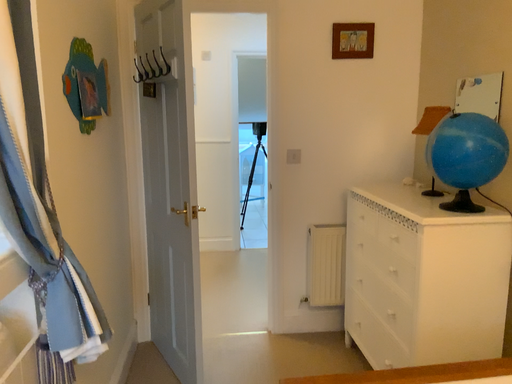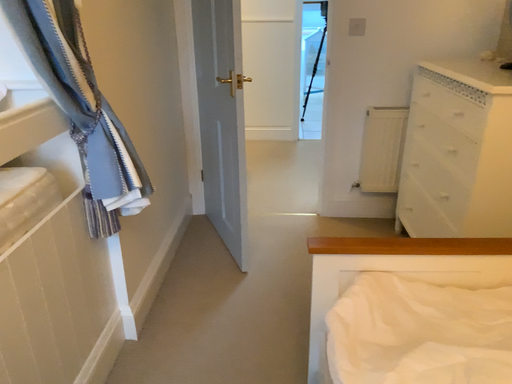
Question: Which way did the camera rotate in the video?

Choices:
 (A) rotated right
 (B) rotated left

Answer: (B)